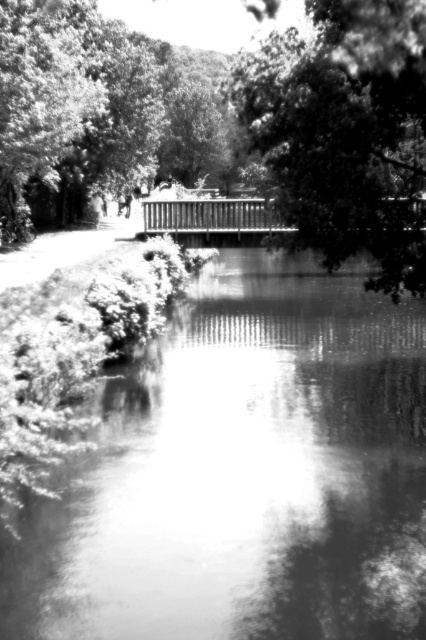
In the scene shown: Between smooth water at center and smooth green leafy tree at center, which one has less height?

Standing shorter between the two is smooth water at center.

Is point (336, 445) closer to viewer compared to point (319, 176)?

No, (336, 445) is further to viewer.

Where is `smooth water at center`? smooth water at center is located at coordinates (244, 474).